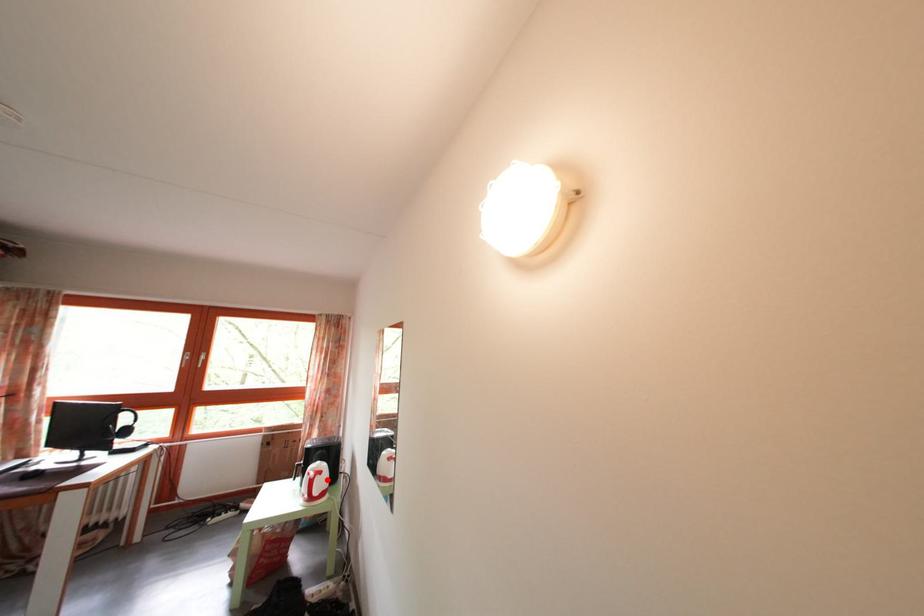
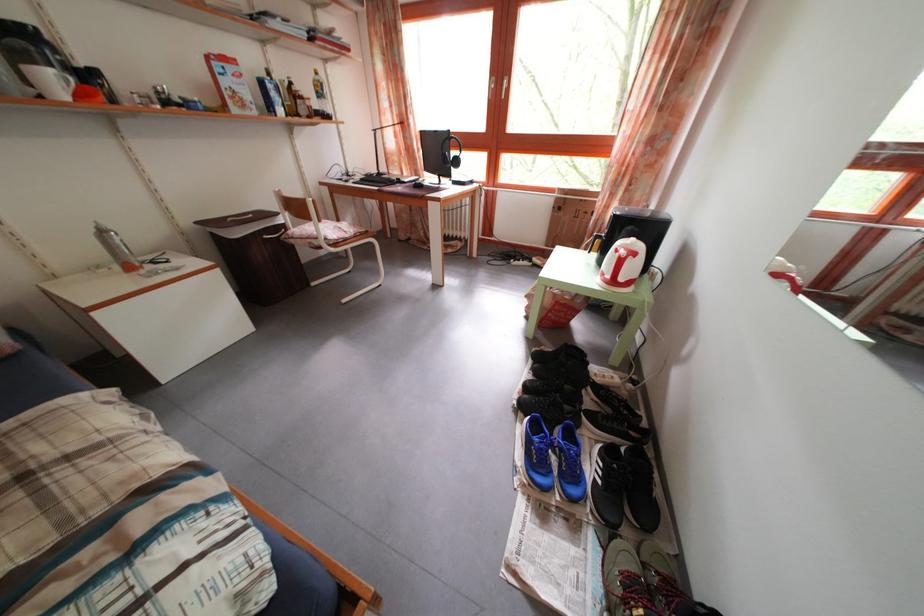
Question: I am providing you with two images of the same scene from different viewpoints. Image1 has a red point marked. In image2, the corresponding 3D location appears at what relative position? Reply with the corresponding letter.

Choices:
 (A) Closer
 (B) Farther

Answer: (B)